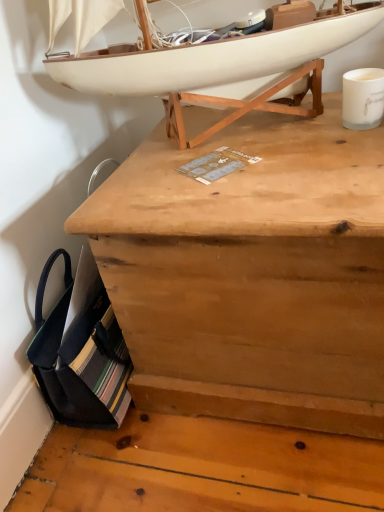
What are the coordinates of `free space to the left of white matte coffee cup at upper right` in the screenshot? It's located at pyautogui.click(x=274, y=138).